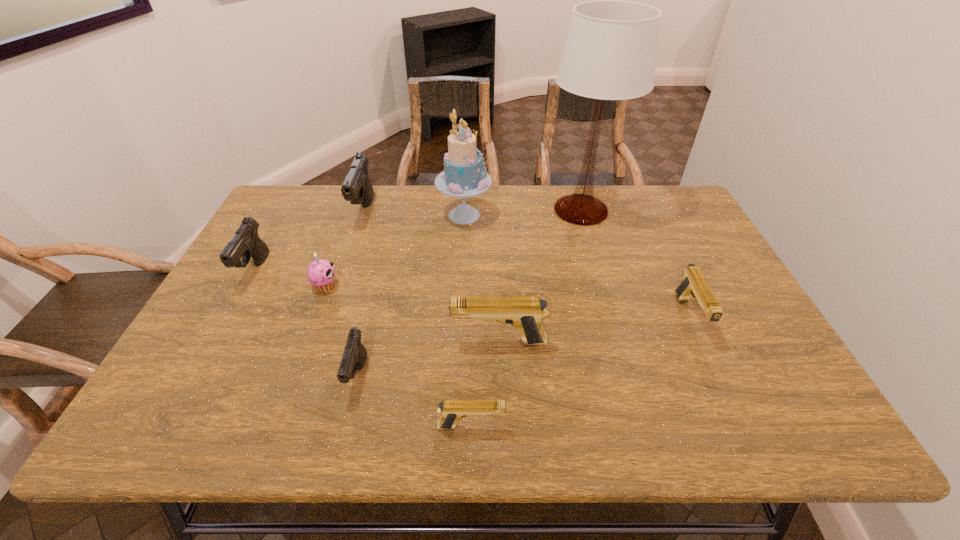
Locate an element on the screen. This screenshot has width=960, height=540. object located in the right edge section of the desktop is located at coordinates (693, 285).

What are the coordinates of `free space at the far edge of the desktop` in the screenshot? It's located at (343, 210).

You are a GUI agent. You are given a task and a screenshot of the screen. Output one action in this format:
    pyautogui.click(x=<x>, y=<y>)
    Task: Click on the free space at the near edge of the desktop
    The image size is (960, 540).
    Given the screenshot: What is the action you would take?
    pyautogui.click(x=528, y=436)

You are a GUI agent. You are given a task and a screenshot of the screen. Output one action in this format:
    pyautogui.click(x=<x>, y=<y>)
    Task: Click on the free region at the left edge of the desktop
    The image size is (960, 540).
    Given the screenshot: What is the action you would take?
    coord(254,265)

I want to click on vacant point at the right edge, so click(659, 246).

Image resolution: width=960 pixels, height=540 pixels. I want to click on free space at the far right corner, so click(x=660, y=188).

Identify the location of vacant space in between the cake and the second smallest black pistol. The image size is (960, 540). (360, 243).

The image size is (960, 540). In order to click on vacant area that lies between the rightmost object and the smallest tan pistol in this screenshot , I will do `click(580, 372)`.

This screenshot has height=540, width=960. Identify the location of vacant area that lies between the nearest pistol and the biggest tan pistol. (485, 384).

You are a GUI agent. You are given a task and a screenshot of the screen. Output one action in this format:
    pyautogui.click(x=<x>, y=<y>)
    Task: Click on the free spot between the tallest object and the biggest tan pistol
    This screenshot has height=540, width=960.
    Given the screenshot: What is the action you would take?
    pyautogui.click(x=540, y=276)